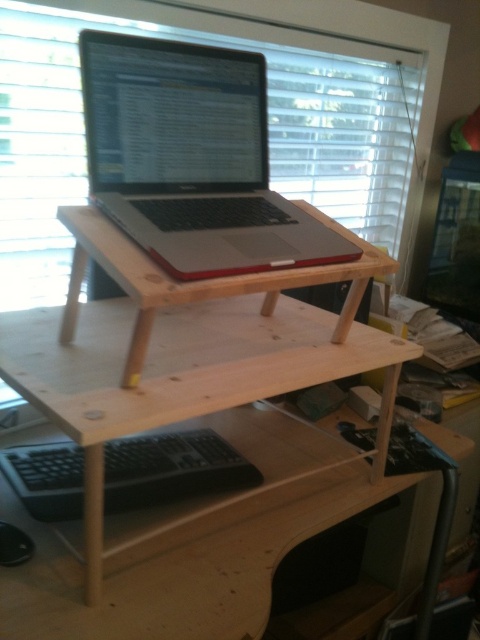
You are a photographer setting up a shot of the desk. The camera is positioned to capture the entire desk, including the satin silver laptop at center. If the camera can focus on objects within 30 inches, will the laptop be in focus?

The satin silver laptop at center is 29.66 inches away from the camera, which is within the focus range of 30 inches. Therefore, the laptop will be in focus.

You are trying to place a new wireless keyboard that is 5 inches long on the desk. The keyboard needs to be placed between the satin silver laptop at center and the natural wood laptop stand at center. Is there enough space between them to fit the keyboard?

The satin silver laptop at center is 4.64 inches away from natural wood laptop stand at center. Since the keyboard is 5 inches long, it would not fit between them as the distance is shorter than the keyboard length.

You are trying to locate your keyboard in a home office setup. You see a satin silver laptop at center and a black matte keyboard at lower center. According to the scene, which object is positioned to the right side?

The satin silver laptop at center is to the right of the black matte keyboard at lower center.